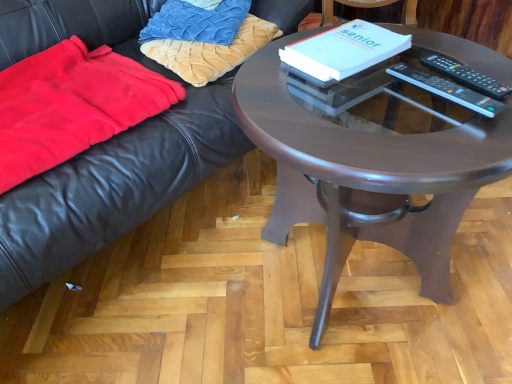
Where is `vacant space positioned to the left of matte brown table at center`? This screenshot has height=384, width=512. vacant space positioned to the left of matte brown table at center is located at coordinates (170, 282).